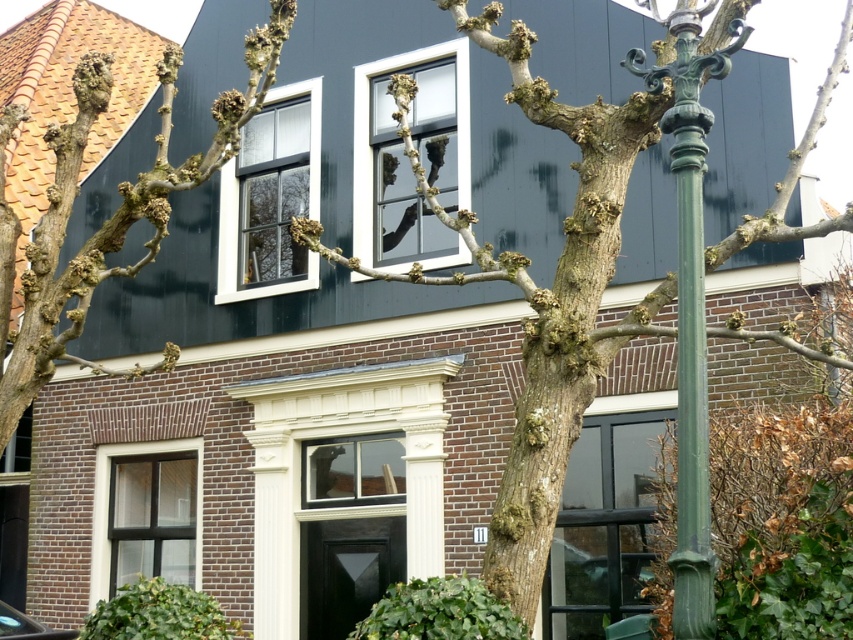
Question: Can you confirm if bare branches at upper left is positioned to the left of green polished metal pole at right?

Choices:
 (A) no
 (B) yes

Answer: (B)

Question: Which object appears farthest from the camera in this image?

Choices:
 (A) bark textured tree at center
 (B) bare branches at upper left
 (C) green polished metal pole at right

Answer: (B)

Question: Which point is farther to the camera?

Choices:
 (A) (697, 104)
 (B) (120, 376)
 (C) (834, 72)

Answer: (B)

Question: Is bark textured tree at center to the right of bare branches at upper left from the viewer's perspective?

Choices:
 (A) yes
 (B) no

Answer: (A)

Question: Is bark textured tree at center thinner than green polished metal pole at right?

Choices:
 (A) no
 (B) yes

Answer: (A)

Question: Which point is closer to the camera taking this photo?

Choices:
 (A) (570, 404)
 (B) (677, 205)

Answer: (B)